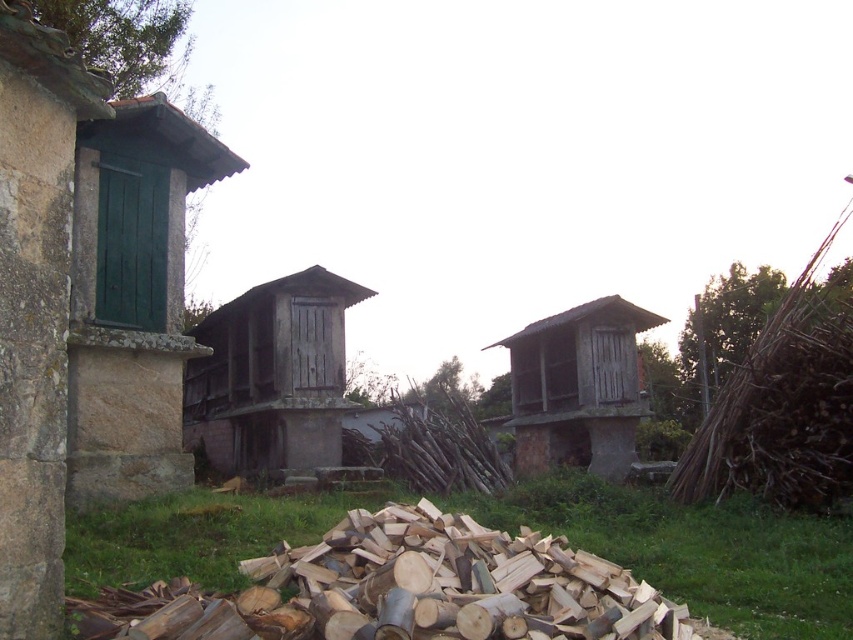
Which is behind, point (805, 531) or point (326, 465)?

The point (326, 465) is behind.

Which is in front, point (747, 580) or point (341, 294)?

Point (747, 580) is in front.

Identify the location of green grass at lower center. (701, 552).

Does weathered wood hut at center appear over wooden hut at center?

Yes, weathered wood hut at center is above wooden hut at center.

Who is more distant from viewer, (201, 362) or (599, 336)?

The point (201, 362) is more distant.

You are a GUI agent. You are given a task and a screenshot of the screen. Output one action in this format:
    pyautogui.click(x=<x>, y=<y>)
    Task: Click on the weathered wood hut at center
    This screenshot has height=640, width=853.
    Given the screenshot: What is the action you would take?
    pyautogui.click(x=271, y=376)

Where is `green grass at lower center`? Image resolution: width=853 pixels, height=640 pixels. green grass at lower center is located at coordinates (701, 552).

Which is above, green grass at lower center or wooden hut at center?

Positioned higher is wooden hut at center.

Find the location of a particular element. The image size is (853, 640). green grass at lower center is located at coordinates (701, 552).